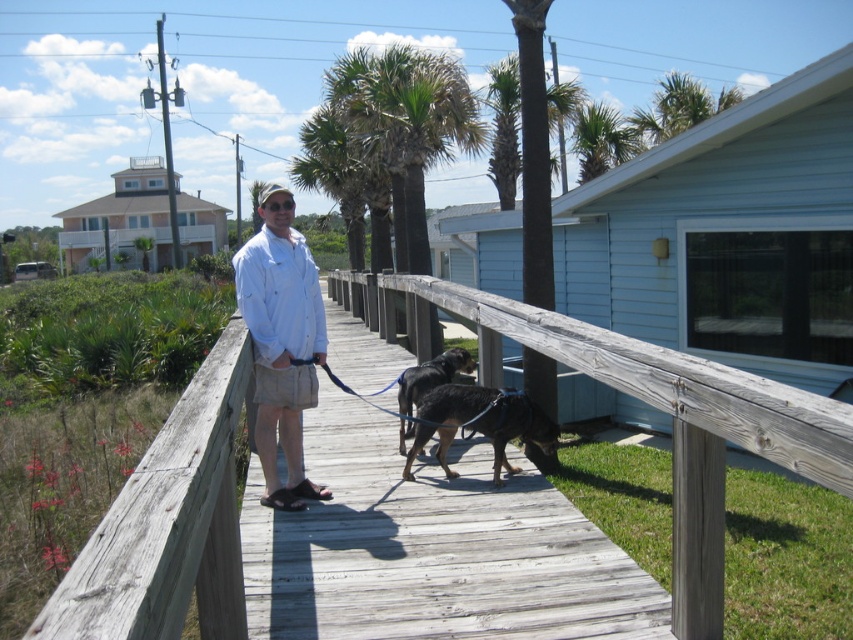
Who is more forward, (x=405, y=422) or (x=299, y=486)?

Point (x=299, y=486)

Which is in front, point (450, 369) or point (326, 492)?

Positioned in front is point (326, 492).

Where is `black fur dog at center`? black fur dog at center is located at coordinates (x=426, y=385).

What do you see at coordinates (599, 140) in the screenshot? This screenshot has height=640, width=853. I see `green leafy palm tree at upper center` at bounding box center [599, 140].

Looking at this image, does green leafy palm tree at upper center come in front of black suede sandal at lower center?

No, green leafy palm tree at upper center is further to the viewer.

The width and height of the screenshot is (853, 640). I want to click on green leafy palm tree at upper center, so click(599, 140).

Which of these two, weathered wood rail at center or green leafy palm tree at upper center, stands shorter?

With less height is weathered wood rail at center.

Who is positioned more to the right, weathered wood rail at center or green leafy palm tree at upper center?

green leafy palm tree at upper center

Is point (704, 547) farther from camera compared to point (585, 179)?

That is False.

Where is `weathered wood rail at center`? This screenshot has height=640, width=853. weathered wood rail at center is located at coordinates (665, 412).